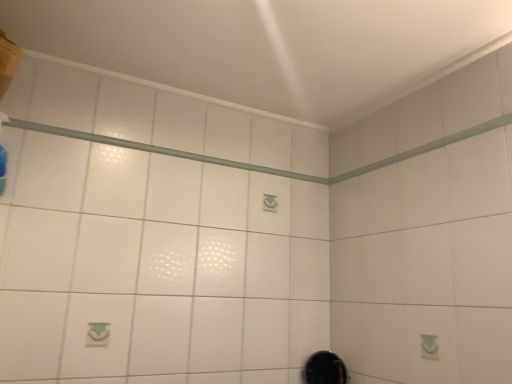
Question: From a real-world perspective, relative to white glossy shower at upper center, is black glossy mirror at lower right vertically above or below?

Choices:
 (A) above
 (B) below

Answer: (B)

Question: Would you say black glossy mirror at lower right is to the left or to the right of white glossy shower at upper center in the picture?

Choices:
 (A) left
 (B) right

Answer: (B)

Question: Considering the positions of black glossy mirror at lower right and white glossy shower at upper center in the image, is black glossy mirror at lower right wider or thinner than white glossy shower at upper center?

Choices:
 (A) wide
 (B) thin

Answer: (A)

Question: Looking at their shapes, would you say white glossy shower at upper center is wider or thinner than black glossy mirror at lower right?

Choices:
 (A) wide
 (B) thin

Answer: (B)

Question: From the image's perspective, is white glossy shower at upper center above or below black glossy mirror at lower right?

Choices:
 (A) above
 (B) below

Answer: (A)

Question: Visually, is white glossy shower at upper center positioned to the left or to the right of black glossy mirror at lower right?

Choices:
 (A) right
 (B) left

Answer: (B)

Question: Is white glossy shower at upper center taller or shorter than black glossy mirror at lower right?

Choices:
 (A) short
 (B) tall

Answer: (A)